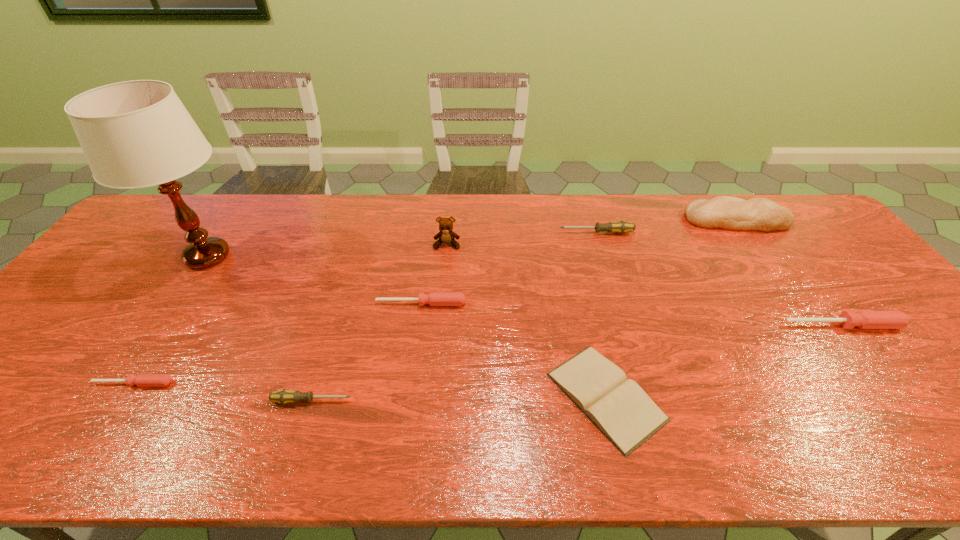
The width and height of the screenshot is (960, 540). Find the location of `table lamp`. table lamp is located at coordinates (134, 134).

Identify the location of brown table lamp. (134, 134).

Locate an element on the screen. The image size is (960, 540). the second tallest object is located at coordinates (446, 235).

At what (x,y) coordinates should I click in order to perform the action: click on brown teddy bear. Please return your answer as a coordinate pair (x, y). The width and height of the screenshot is (960, 540). Looking at the image, I should click on (446, 235).

You are a GUI agent. You are given a task and a screenshot of the screen. Output one action in this format:
    pyautogui.click(x=<x>, y=<y>)
    Task: Click on the seventh shortest object
    The width and height of the screenshot is (960, 540).
    Given the screenshot: What is the action you would take?
    pyautogui.click(x=727, y=212)

Identify the location of the right gray screwdriver. (620, 227).

Where is `the farther gray screwdriver`? The image size is (960, 540). the farther gray screwdriver is located at coordinates (620, 227).

This screenshot has width=960, height=540. Identify the location of the biggest red screwdriver. (861, 319).

You are a GUI agent. You are given a task and a screenshot of the screen. Output one action in this format:
    pyautogui.click(x=<x>, y=<y>)
    Task: Click on the second nearest red screwdriver
    The width and height of the screenshot is (960, 540).
    Given the screenshot: What is the action you would take?
    pyautogui.click(x=861, y=319)

What are the coordinates of `the second red screwdriver from right to left` in the screenshot? It's located at (434, 298).